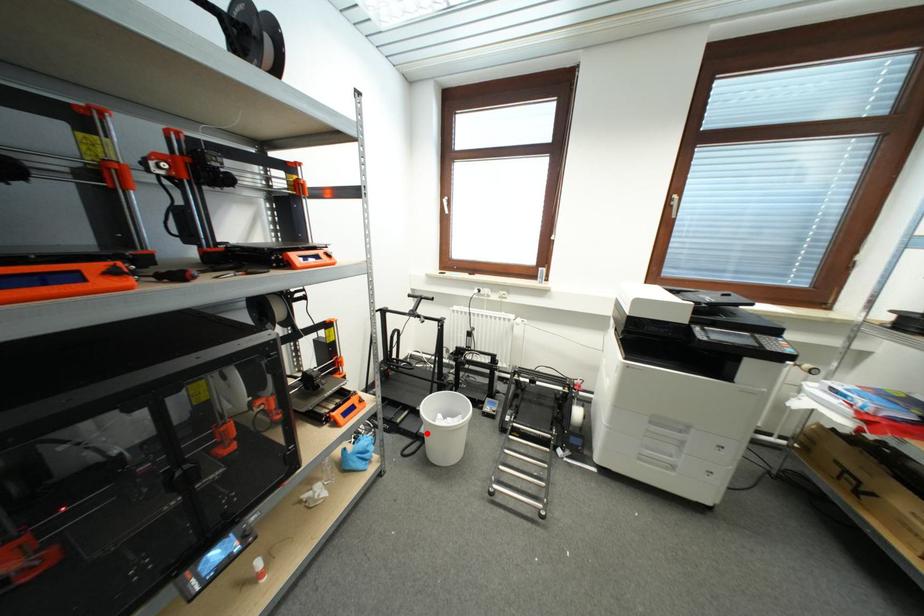
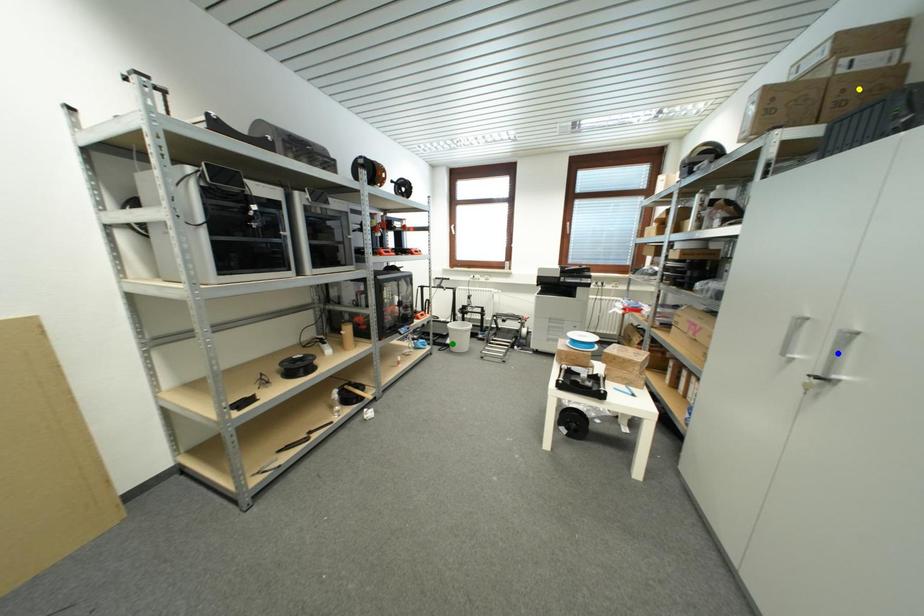
Question: I am providing you with two images of the same scene from different viewpoints. A red point is marked on the first image. You are given multiple points on the second image. Can you choose the point in image 2 that corresponds to the point in image 1?

Choices:
 (A) yellow point
 (B) green point
 (C) blue point

Answer: (B)